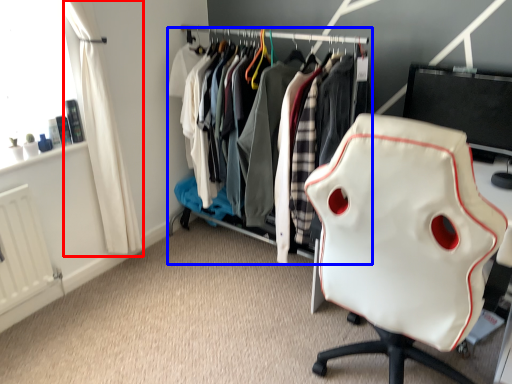
Question: Which object appears farthest to the camera in this image, curtain (highlighted by a red box) or closet (highlighted by a blue box)?

Choices:
 (A) curtain
 (B) closet

Answer: (B)